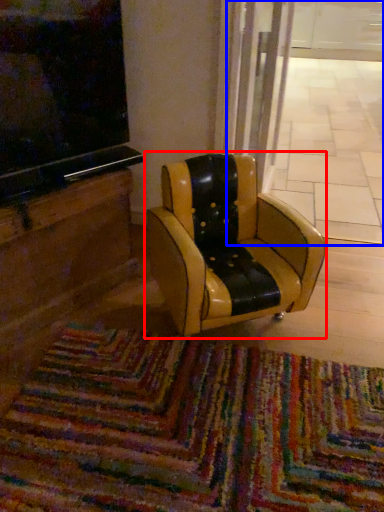
Question: Which object appears closest to the camera in this image, chair (highlighted by a red box) or shop window (highlighted by a blue box)?

Choices:
 (A) chair
 (B) shop window

Answer: (A)